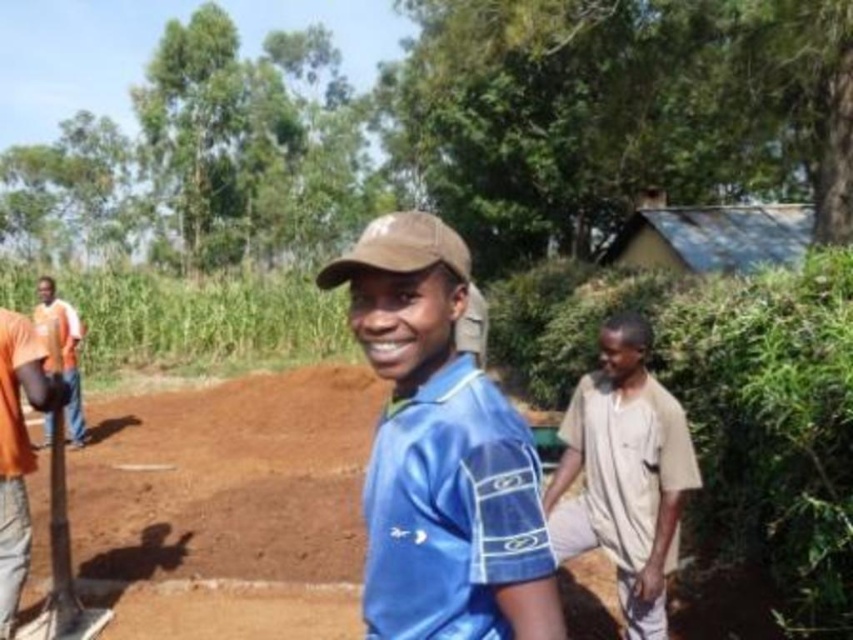
Which is below, light beige cotton shirt at right or orange fabric shirt at left?

light beige cotton shirt at right

Who is positioned more to the left, light beige cotton shirt at right or orange fabric shirt at left?

orange fabric shirt at left is more to the left.

Which is in front, point (682, 488) or point (70, 428)?

Point (682, 488) is more forward.

Identify the location of light beige cotton shirt at right. (624, 474).

Between point (479, 410) and point (607, 323), which one is positioned behind?

The point (607, 323) is behind.

Between point (509, 513) and point (593, 396), which one is positioned in front?

Point (509, 513) is more forward.

I want to click on blue fabric shirt at center, so click(x=440, y=454).

Between blue fabric shirt at center and orange fabric shirt at left, which one appears on the right side from the viewer's perspective?

From the viewer's perspective, blue fabric shirt at center appears more on the right side.

Can you confirm if blue fabric shirt at center is wider than orange fabric shirt at left?

Correct, the width of blue fabric shirt at center exceeds that of orange fabric shirt at left.

Find the location of a particular element. blue fabric shirt at center is located at coordinates (440, 454).